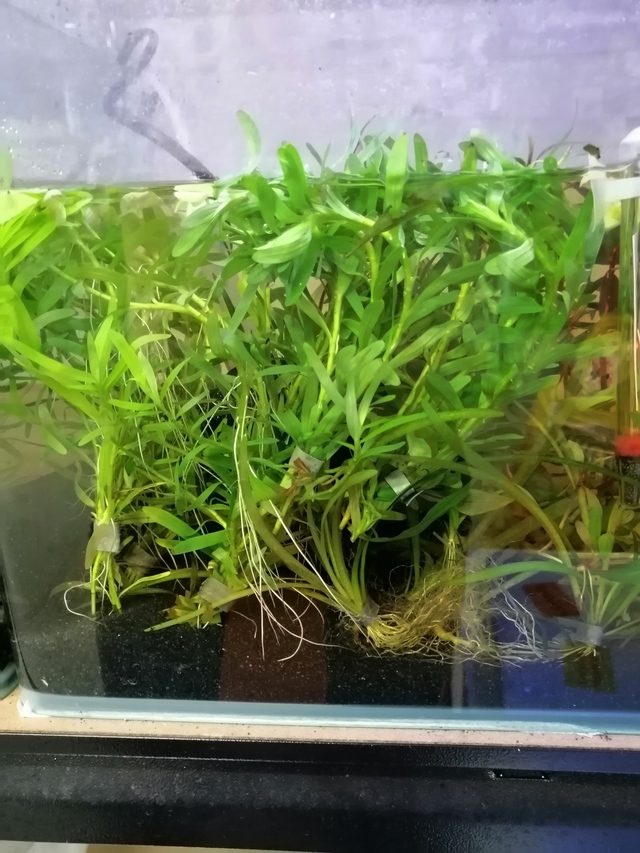
Where is `thin wood board`? This screenshot has height=853, width=640. thin wood board is located at coordinates (157, 734).